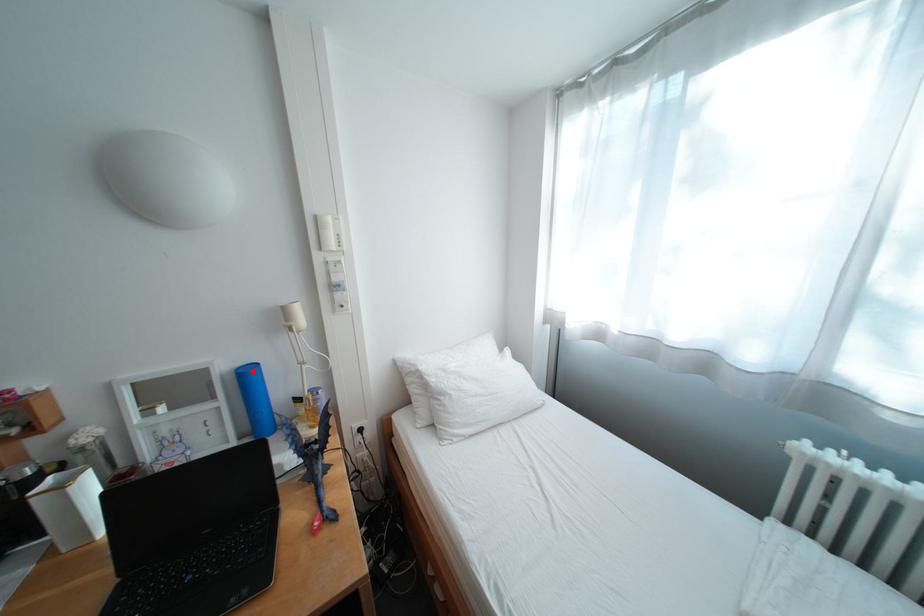
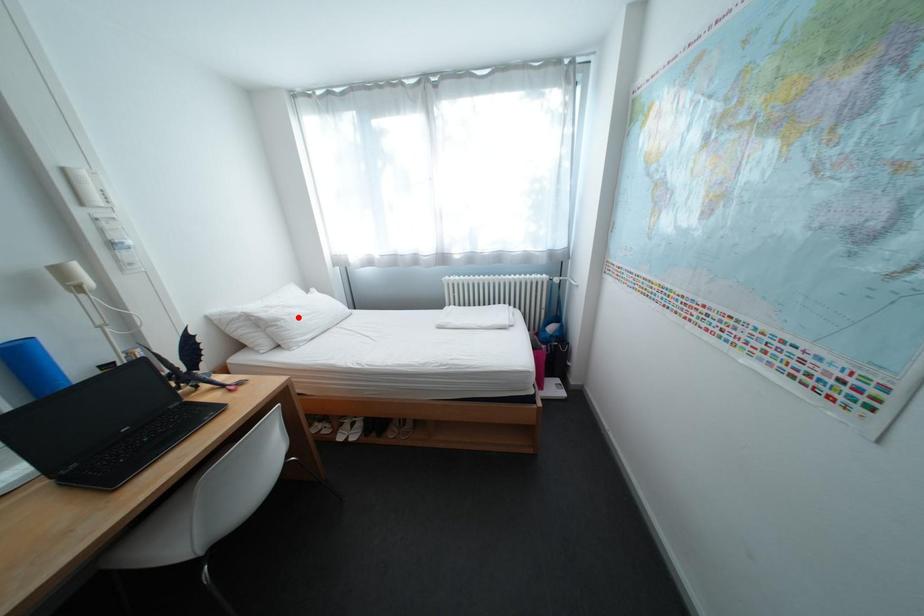
Based on the photo, I am providing you with two images of the same scene from different viewpoints. A red point is marked on the first image and another point is marked on the second image. Are the points marked in image1 and image2 representing the same 3D position?

No